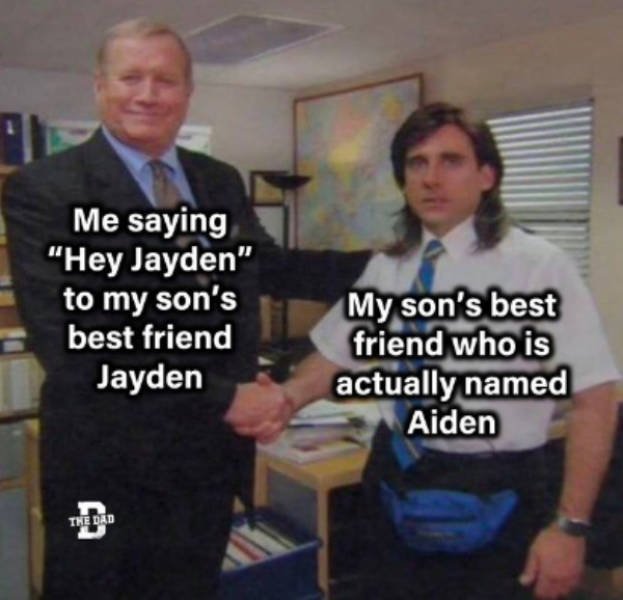
Image resolution: width=623 pixels, height=600 pixels. I want to click on world map in frame, so click(324, 129).